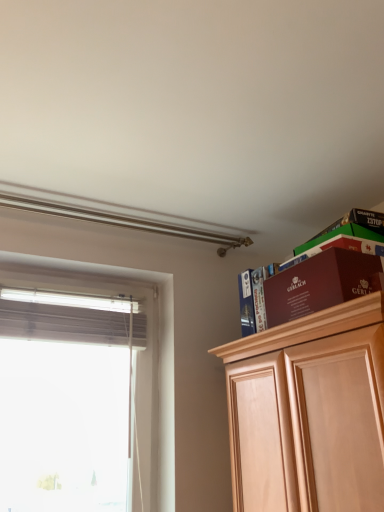
Question: From the image's perspective, is matte brown book at upper right above white matte window at left?

Choices:
 (A) no
 (B) yes

Answer: (B)

Question: Is matte brown book at upper right to the left of white matte window at left from the viewer's perspective?

Choices:
 (A) yes
 (B) no

Answer: (B)

Question: Can white matte window at left be found inside matte brown book at upper right?

Choices:
 (A) yes
 (B) no

Answer: (B)

Question: Would you consider matte brown book at upper right to be distant from white matte window at left?

Choices:
 (A) yes
 (B) no

Answer: (A)

Question: Does matte brown book at upper right turn towards white matte window at left?

Choices:
 (A) no
 (B) yes

Answer: (A)

Question: Is matte brown book at upper right thinner than white matte window at left?

Choices:
 (A) yes
 (B) no

Answer: (A)

Question: Is the position of maroon cardboard box at upper right less distant than that of matte brown book at upper right?

Choices:
 (A) no
 (B) yes

Answer: (B)

Question: Does maroon cardboard box at upper right have a smaller size compared to matte brown book at upper right?

Choices:
 (A) yes
 (B) no

Answer: (B)

Question: Is maroon cardboard box at upper right to the right of matte brown book at upper right from the viewer's perspective?

Choices:
 (A) no
 (B) yes

Answer: (B)

Question: Considering the relative positions of maroon cardboard box at upper right and matte brown book at upper right in the image provided, is maroon cardboard box at upper right to the left of matte brown book at upper right from the viewer's perspective?

Choices:
 (A) no
 (B) yes

Answer: (A)

Question: Is maroon cardboard box at upper right oriented towards matte brown book at upper right?

Choices:
 (A) no
 (B) yes

Answer: (A)

Question: Is maroon cardboard box at upper right far away from matte brown book at upper right?

Choices:
 (A) yes
 (B) no

Answer: (B)

Question: Is maroon cardboard box at upper right closer to camera compared to white matte window at left?

Choices:
 (A) no
 (B) yes

Answer: (B)